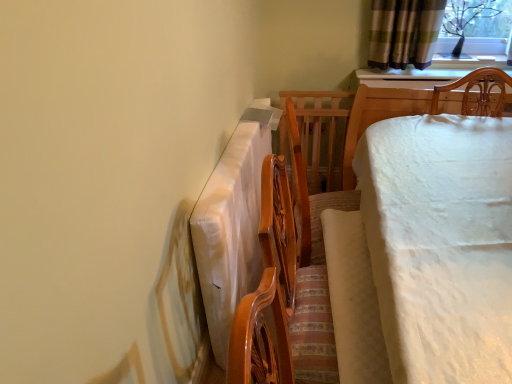
Image resolution: width=512 pixels, height=384 pixels. Identify the location of free spot above light beige fabric at center (from a real-world perspective). click(x=354, y=281).